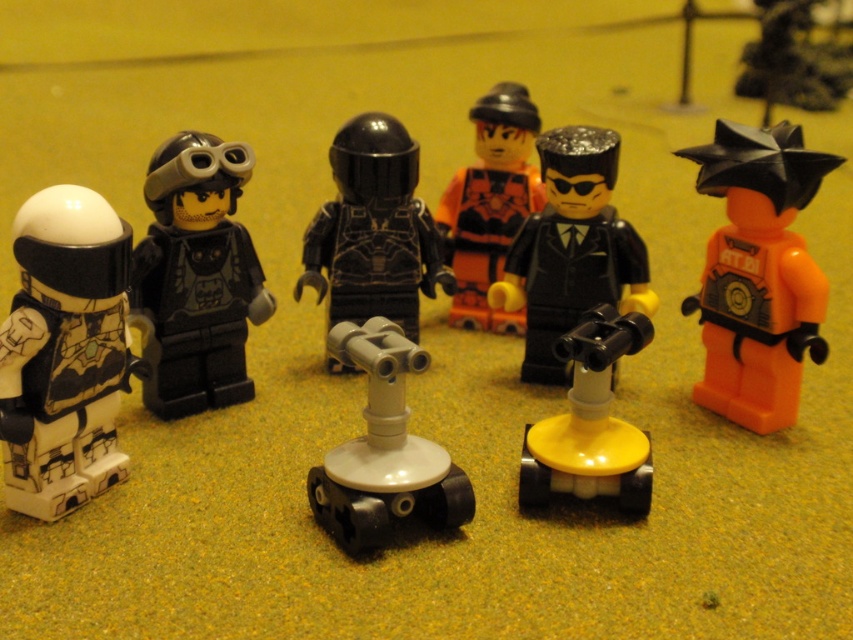
Can you confirm if matte black helmet at left is bigger than black matte helmet at center?

Incorrect, matte black helmet at left is not larger than black matte helmet at center.

Between matte black helmet at left and black matte helmet at center, which one is positioned lower?

matte black helmet at left is below.

Is point (245, 397) positioned after point (416, 296)?

No, it is not.

Locate an element on the screen. The height and width of the screenshot is (640, 853). matte black helmet at left is located at coordinates (196, 276).

Who is more forward, (782, 179) or (479, 260)?

Point (782, 179)

Consider the image. Can you confirm if orange matte/soft plastic figure at right is positioned to the right of orange matte minifigure at center?

Indeed, orange matte/soft plastic figure at right is positioned on the right side of orange matte minifigure at center.

Identify the location of orange matte/soft plastic figure at right. (758, 273).

In order to click on orange matte/soft plastic figure at right in this screenshot , I will do `click(758, 273)`.

Is point (453, 525) more distant than point (606, 449)?

That is False.

Is point (386, 509) positioned before point (567, 420)?

Yes, point (386, 509) is closer to viewer.

Locate an element on the screen. white plastic tripod at center is located at coordinates (383, 449).